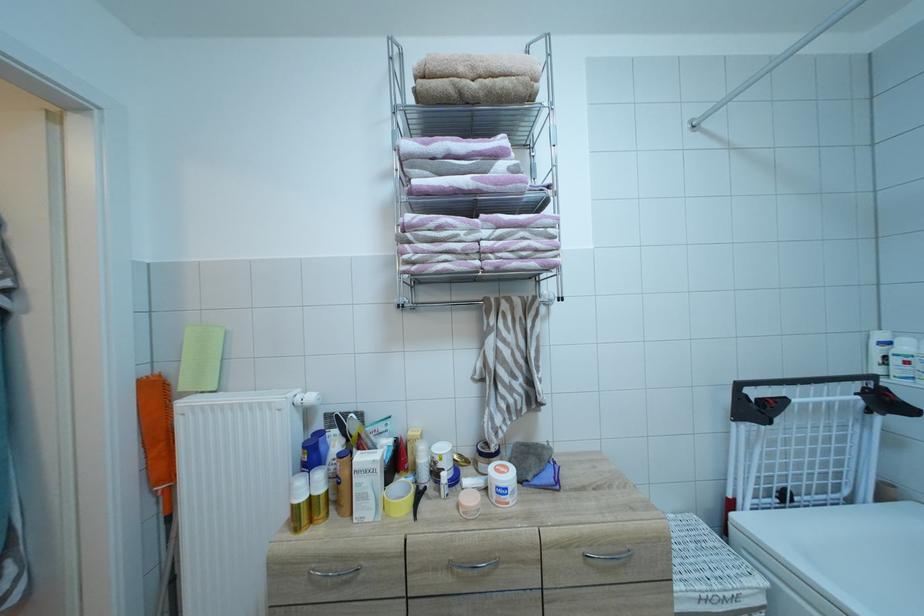
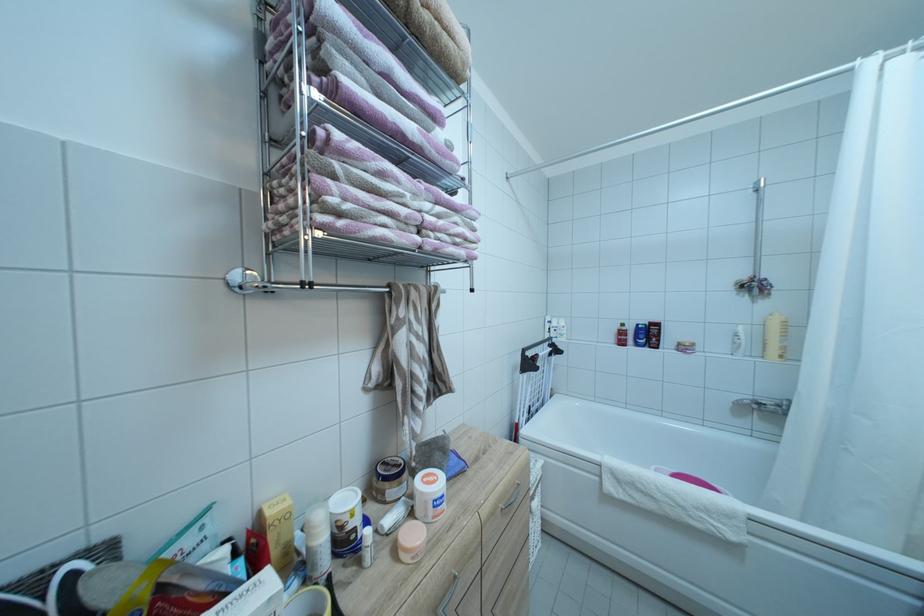
In the second image, find the point that corresponds to [505,233] in the first image.

(444, 209)